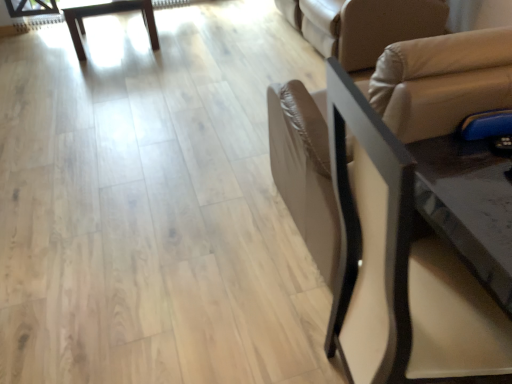
The width and height of the screenshot is (512, 384). In order to click on black leather chair at right in this screenshot , I will do `click(412, 289)`.

What do you see at coordinates (105, 14) in the screenshot? I see `wooden table at upper left` at bounding box center [105, 14].

Locate an element on the screen. This screenshot has height=384, width=512. black leather chair at right is located at coordinates (412, 289).

In terms of height, does beige leather futon at upper right look taller or shorter compared to black leather chair at right?

In the image, beige leather futon at upper right appears to be shorter than black leather chair at right.

From a real-world perspective, between beige leather futon at upper right and black leather chair at right, who is vertically lower?

In real-world perspective, beige leather futon at upper right is lower.

Is beige leather futon at upper right positioned beyond the bounds of black leather chair at right?

Yes.

The height and width of the screenshot is (384, 512). In order to click on chair to the left of beige leather futon at upper right in this screenshot , I will do `click(412, 289)`.

Considering the sizes of objects beige leather futon at upper right and wooden table at upper left in the image provided, who is thinner, beige leather futon at upper right or wooden table at upper left?

Thinner between the two is wooden table at upper left.

Which object is more forward, beige leather futon at upper right or wooden table at upper left?

Positioned in front is beige leather futon at upper right.

Is beige leather futon at upper right not within wooden table at upper left?

Indeed, beige leather futon at upper right is completely outside wooden table at upper left.

Which of these two, black leather chair at right or wooden table at upper left, is wider?

Wider between the two is wooden table at upper left.

Is black leather chair at right positioned with its back to wooden table at upper left?

No, black leather chair at right is not facing away from wooden table at upper left.

Is the depth of black leather chair at right less than that of wooden table at upper left?

Yes, it is.

Where is `chair above the wooden table at upper left (from a real-world perspective)`? This screenshot has height=384, width=512. chair above the wooden table at upper left (from a real-world perspective) is located at coordinates (412, 289).

From a real-world perspective, is wooden table at upper left positioned over black leather chair at right based on gravity?

No, from a real-world perspective, wooden table at upper left is not above black leather chair at right.

From the image's perspective, is wooden table at upper left positioned above or below black leather chair at right?

Clearly, from the image's perspective, wooden table at upper left is above black leather chair at right.

How different are the orientations of wooden table at upper left and black leather chair at right in degrees?

There is a 82.6-degree angle between the facing directions of wooden table at upper left and black leather chair at right.

Relative to black leather chair at right, is wooden table at upper left in front or behind?

Clearly, wooden table at upper left is behind black leather chair at right.

Could you tell me if wooden table at upper left is facing beige leather futon at upper right?

No.

Considering the sizes of objects wooden table at upper left and beige leather futon at upper right in the image provided, who is shorter, wooden table at upper left or beige leather futon at upper right?

Standing shorter between the two is wooden table at upper left.

Does wooden table at upper left appear on the left side of beige leather futon at upper right?

Yes.

How many degrees apart are the facing directions of wooden table at upper left and beige leather futon at upper right?

The facing directions of wooden table at upper left and beige leather futon at upper right are 89.7 degrees apart.

From a real-world perspective, between black leather chair at right and beige leather futon at upper right, who is vertically lower?

beige leather futon at upper right is physically lower.

Does black leather chair at right turn towards beige leather futon at upper right?

No, black leather chair at right is not turned towards beige leather futon at upper right.

Considering the relative positions of black leather chair at right and beige leather futon at upper right in the image provided, is black leather chair at right to the left or to the right of beige leather futon at upper right?

black leather chair at right is positioned on beige leather futon at upper right's left side.

In the image, is black leather chair at right positioned in front of or behind beige leather futon at upper right?

black leather chair at right is in front of beige leather futon at upper right.

Image resolution: width=512 pixels, height=384 pixels. Identify the location of futon directly beneath the black leather chair at right (from a real-world perspective). (362, 25).

Where is `table above the beige leather futon at upper right (from the image's perspective)`? table above the beige leather futon at upper right (from the image's perspective) is located at coordinates (105, 14).

Looking at this image, considering their positions, is beige leather futon at upper right positioned further to black leather chair at right than wooden table at upper left?

wooden table at upper left is positioned further to the anchor black leather chair at right.

Which object lies nearer to the anchor point beige leather futon at upper right, black leather chair at right or wooden table at upper left?

The object closer to beige leather futon at upper right is black leather chair at right.

Estimate the real-world distances between objects in this image. Which object is closer to wooden table at upper left, black leather chair at right or beige leather futon at upper right?

Among the two, beige leather futon at upper right is located nearer to wooden table at upper left.

Considering their positions, is wooden table at upper left positioned closer to beige leather futon at upper right than black leather chair at right?

Based on the image, black leather chair at right appears to be nearer to beige leather futon at upper right.

Considering their positions, is beige leather futon at upper right positioned further to wooden table at upper left than black leather chair at right?

black leather chair at right lies further to wooden table at upper left than the other object.

Looking at this image, estimate the real-world distances between objects in this image. Which object is further from black leather chair at right, wooden table at upper left or beige leather futon at upper right?

wooden table at upper left is positioned further to the anchor black leather chair at right.

The image size is (512, 384). I want to click on futon positioned between black leather chair at right and wooden table at upper left from near to far, so click(x=362, y=25).